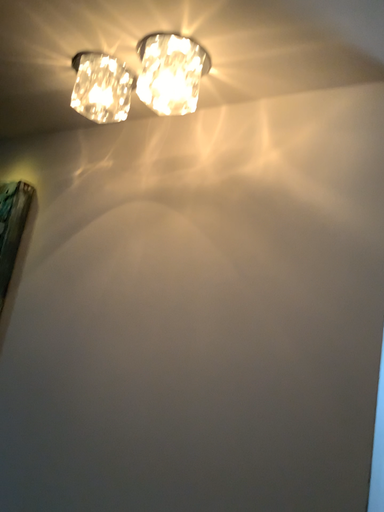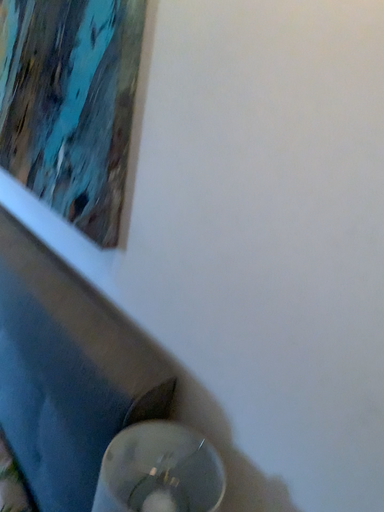
Question: Which way did the camera rotate in the video?

Choices:
 (A) rotated downward
 (B) rotated upward

Answer: (A)